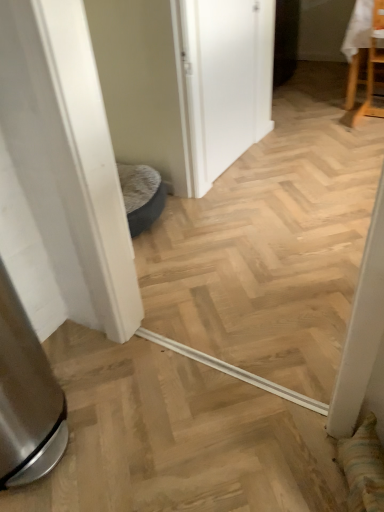
Question: Is the position of wooden chair at upper right less distant than that of white matte door at center?

Choices:
 (A) no
 (B) yes

Answer: (A)

Question: Is wooden chair at upper right positioned behind white matte door at center?

Choices:
 (A) yes
 (B) no

Answer: (A)

Question: Considering the relative sizes of wooden chair at upper right and white matte door at center in the image provided, is wooden chair at upper right taller than white matte door at center?

Choices:
 (A) no
 (B) yes

Answer: (A)

Question: Is wooden chair at upper right in contact with white matte door at center?

Choices:
 (A) yes
 (B) no

Answer: (B)

Question: Is wooden chair at upper right to the left of white matte door at center from the viewer's perspective?

Choices:
 (A) yes
 (B) no

Answer: (B)

Question: From a real-world perspective, is wooden chair at upper right below white matte door at center?

Choices:
 (A) yes
 (B) no

Answer: (A)

Question: Can you confirm if white matte door at center is wider than wooden chair at upper right?

Choices:
 (A) yes
 (B) no

Answer: (B)

Question: Considering the relative positions of white matte door at center and wooden chair at upper right in the image provided, is white matte door at center to the right of wooden chair at upper right from the viewer's perspective?

Choices:
 (A) no
 (B) yes

Answer: (A)

Question: Would you say white matte door at center is outside wooden chair at upper right?

Choices:
 (A) no
 (B) yes

Answer: (B)

Question: Is white matte door at center smaller than wooden chair at upper right?

Choices:
 (A) no
 (B) yes

Answer: (B)

Question: From a real-world perspective, is white matte door at center located higher than wooden chair at upper right?

Choices:
 (A) no
 (B) yes

Answer: (B)

Question: Is white matte door at center in front of wooden chair at upper right?

Choices:
 (A) no
 (B) yes

Answer: (B)

Question: Based on their sizes in the image, would you say white matte door at center is bigger or smaller than wooden chair at upper right?

Choices:
 (A) big
 (B) small

Answer: (B)